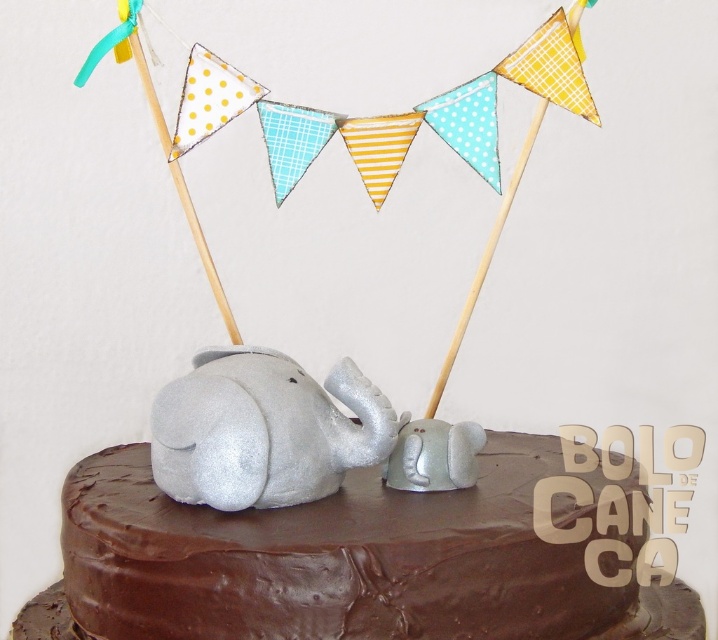
Is chocolate matte elephant at center bigger than silver glitter baby elephant at center?

Indeed, chocolate matte elephant at center has a larger size compared to silver glitter baby elephant at center.

Is chocolate matte elephant at center above silver glitter baby elephant at center?

No, chocolate matte elephant at center is not above silver glitter baby elephant at center.

Does point (276, 536) come in front of point (303, 452)?

Yes, it is.

You are a GUI agent. You are given a task and a screenshot of the screen. Output one action in this format:
    pyautogui.click(x=<x>, y=<y>)
    Task: Click on the chocolate matte elephant at center
    
    Given the screenshot: What is the action you would take?
    pyautogui.click(x=349, y=556)